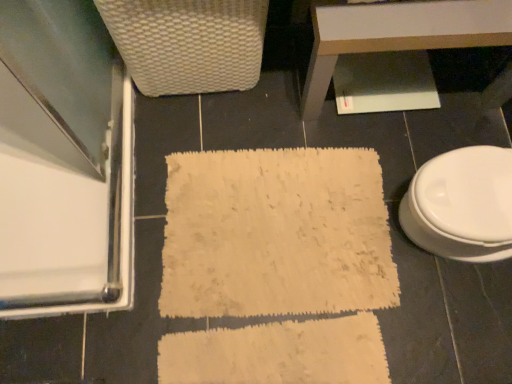
Question: Is the position of white glossy table at upper center more distant than that of white woven basket at upper left?

Choices:
 (A) no
 (B) yes

Answer: (B)

Question: Considering the relative positions of white glossy table at upper center and white woven basket at upper left in the image provided, is white glossy table at upper center to the left of white woven basket at upper left from the viewer's perspective?

Choices:
 (A) no
 (B) yes

Answer: (A)

Question: Would you say white woven basket at upper left is part of white glossy table at upper center's contents?

Choices:
 (A) no
 (B) yes

Answer: (A)

Question: Could you tell me if white glossy table at upper center is facing white woven basket at upper left?

Choices:
 (A) yes
 (B) no

Answer: (B)

Question: Does white glossy table at upper center have a larger size compared to white woven basket at upper left?

Choices:
 (A) no
 (B) yes

Answer: (B)

Question: Does point (25, 117) appear closer or farther from the camera than point (345, 19)?

Choices:
 (A) farther
 (B) closer

Answer: (A)

Question: Based on their sizes in the image, would you say clear glass screen door at left is bigger or smaller than white glossy table at upper center?

Choices:
 (A) small
 (B) big

Answer: (A)

Question: Considering the positions of clear glass screen door at left and white glossy table at upper center in the image, is clear glass screen door at left taller or shorter than white glossy table at upper center?

Choices:
 (A) short
 (B) tall

Answer: (A)

Question: From the image's perspective, is clear glass screen door at left positioned above or below white glossy table at upper center?

Choices:
 (A) above
 (B) below

Answer: (B)

Question: Considering the positions of point (471, 29) and point (489, 213), is point (471, 29) closer or farther from the camera than point (489, 213)?

Choices:
 (A) closer
 (B) farther

Answer: (A)

Question: From a real-world perspective, is white glossy table at upper center positioned above or below white glossy toilet at right?

Choices:
 (A) below
 (B) above

Answer: (A)

Question: Considering their positions, is white glossy table at upper center located in front of or behind white glossy toilet at right?

Choices:
 (A) front
 (B) behind

Answer: (B)

Question: In terms of size, does white glossy table at upper center appear bigger or smaller than white glossy toilet at right?

Choices:
 (A) small
 (B) big

Answer: (B)

Question: Would you say white woven basket at upper left is to the left or to the right of white glossy table at upper center in the picture?

Choices:
 (A) right
 (B) left

Answer: (B)

Question: Is white woven basket at upper left in front of or behind white glossy table at upper center in the image?

Choices:
 (A) front
 (B) behind

Answer: (A)